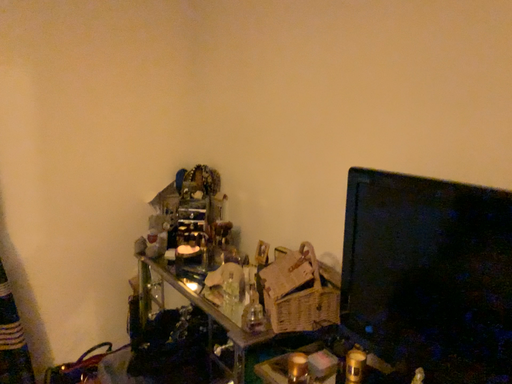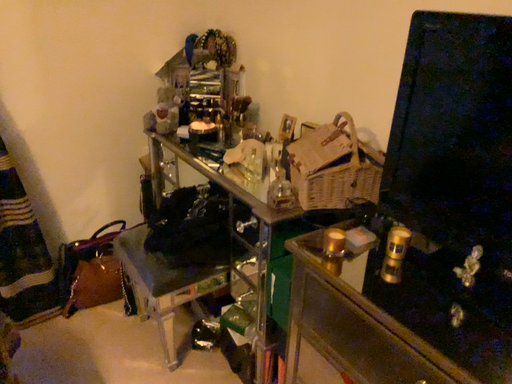
Question: How did the camera likely rotate when shooting the video?

Choices:
 (A) rotated downward
 (B) rotated upward

Answer: (A)